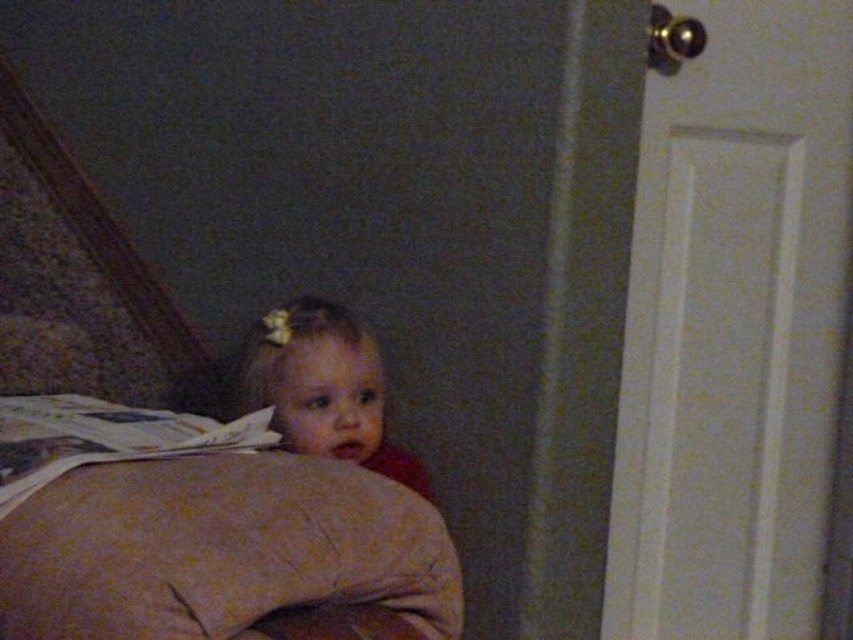
You are trying to place a small toy between the beige fabric pillow at lower left and the smooth beige pillow at center. Based on their widths, which pillow should the toy be placed closer to?

The beige fabric pillow at lower left might be wider than smooth beige pillow at center, so the toy should be placed closer to the beige fabric pillow at lower left to ensure stability.

You are a photographer trying to capture the child hiding behind the bed. You notice two pillows, the beige fabric pillow at lower left and the smooth beige pillow at center. Which pillow should you focus on to ensure it appears larger in your photo?

The beige fabric pillow at lower left is closer to the viewer than the smooth beige pillow at center, so focusing on the beige fabric pillow at lower left will make it appear larger in the photo.

You are a parent trying to reach the beige fabric pillow at lower left from your current position. Considering the distance, can you grab it without moving your feet?

The beige fabric pillow at lower left is 30.44 inches away from viewer, so yes, you can grab it without moving your feet since 30.44 inches is within a comfortable reaching distance.